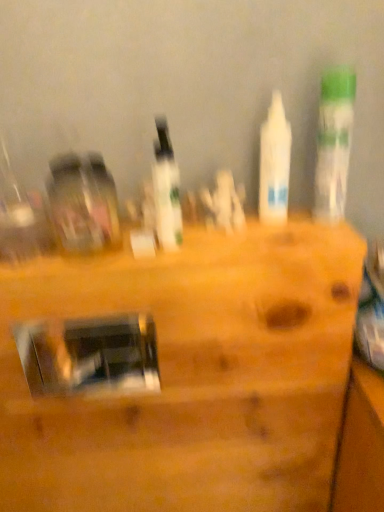
Identify the location of vacant space to the left of white glossy bottle at center, arranged as the 3th bottle when viewed from the right. This screenshot has width=384, height=512. (92, 249).